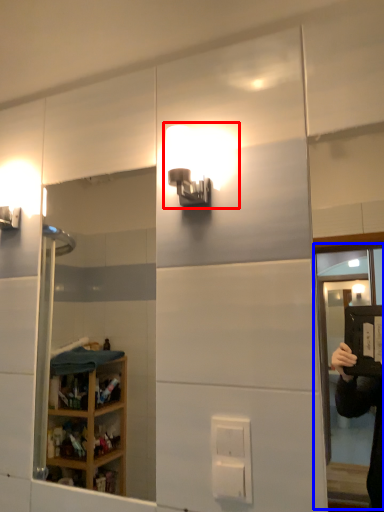
Question: Which point is closer to the camera, light fixture (highlighted by a red box) or screen door (highlighted by a blue box)?

Choices:
 (A) light fixture
 (B) screen door

Answer: (B)